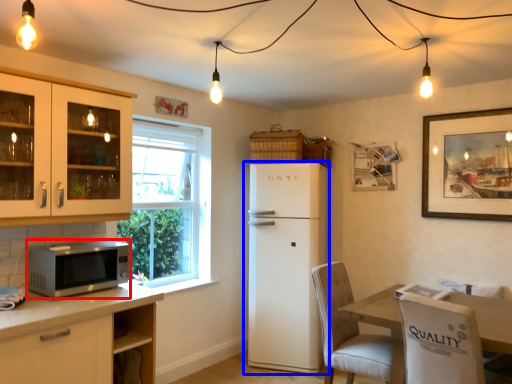
Question: Which of the following is the closest to the observer, microwave oven (highlighted by a red box) or refrigerator (highlighted by a blue box)?

Choices:
 (A) microwave oven
 (B) refrigerator

Answer: (A)